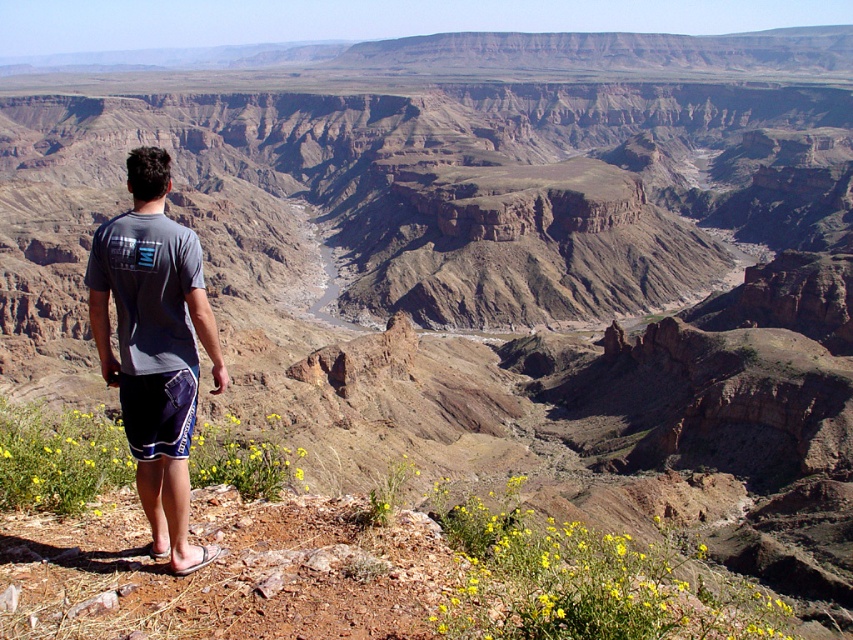
Question: Which point appears closest to the camera in this image?

Choices:
 (A) (409, 568)
 (B) (102, 243)

Answer: (B)

Question: Is yellow matte wildflower at lower left further to the viewer compared to gray fabric t-shirt at center?

Choices:
 (A) no
 (B) yes

Answer: (A)

Question: Where is yellow matte wildflower at lower left located in relation to gray fabric t-shirt at center in the image?

Choices:
 (A) above
 (B) below

Answer: (B)

Question: Does yellow matte wildflower at lower left appear on the right side of gray fabric t-shirt at center?

Choices:
 (A) no
 (B) yes

Answer: (B)